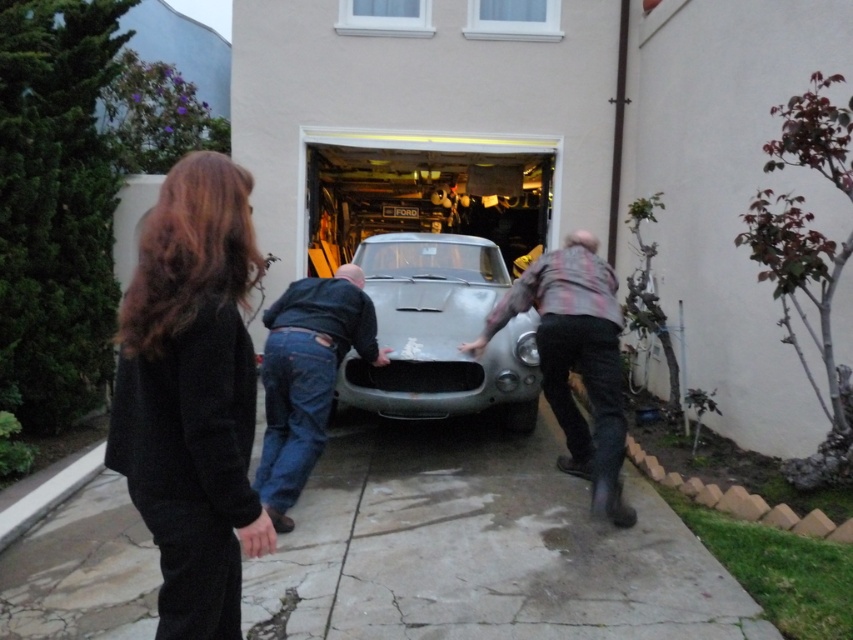
Does dark brown hair at left have a smaller size compared to silver metallic car at center?

Correct, dark brown hair at left occupies less space than silver metallic car at center.

Is point (218, 424) farther from viewer compared to point (395, 326)?

That is False.

Is point (242, 196) closer to camera compared to point (457, 337)?

Yes, it is in front of point (457, 337).

This screenshot has height=640, width=853. Find the location of `dark brown hair at left`. dark brown hair at left is located at coordinates (192, 394).

Based on the photo, does silver metallic car at center have a greater height compared to matte black car at center?

Yes.

Does silver metallic car at center have a larger size compared to matte black car at center?

Yes.

You are a GUI agent. You are given a task and a screenshot of the screen. Output one action in this format:
    pyautogui.click(x=<x>, y=<y>)
    Task: Click on the silver metallic car at center
    
    Given the screenshot: What is the action you would take?
    pyautogui.click(x=440, y=332)

Does point (717, 611) come closer to viewer compared to point (160, 412)?

No, (717, 611) is further to viewer.

Is concrete driveway at center wider than dark brown hair at left?

Yes, concrete driveway at center is wider than dark brown hair at left.

Locate an element on the screen. Image resolution: width=853 pixels, height=640 pixels. concrete driveway at center is located at coordinates (480, 548).